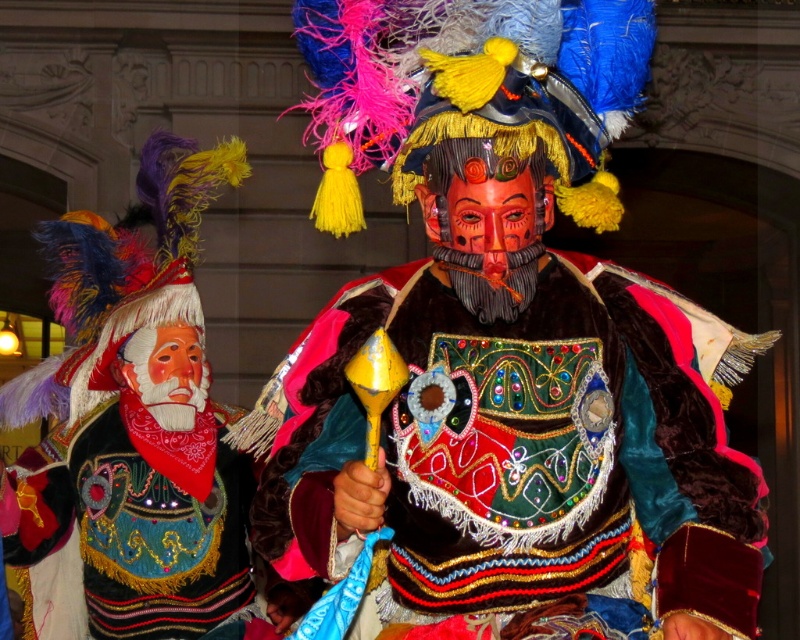
You are standing in front of the two costumed performers. There are two points marked on the image. The first point is at coordinates point (374, 477) and the second point is at point (130, 547). Which point is closer to you?

Point (374, 477) is in front of point (130, 547), so it is closer to you.